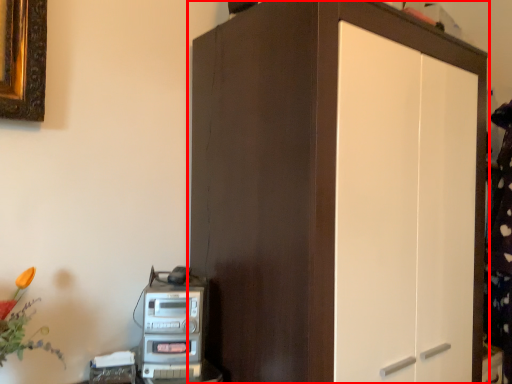
Question: From the image's perspective, what is the correct spatial relationship of cupboard (annotated by the red box) in relation to home appliance?

Choices:
 (A) above
 (B) below

Answer: (A)